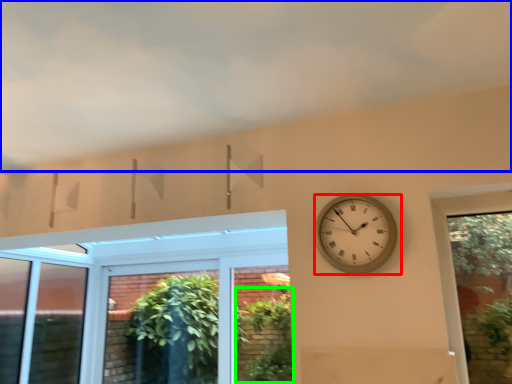
Question: Which is farther away from wall clock (highlighted by a red box)? cloud (highlighted by a blue box) or plant (highlighted by a green box)?

Choices:
 (A) cloud
 (B) plant

Answer: (B)